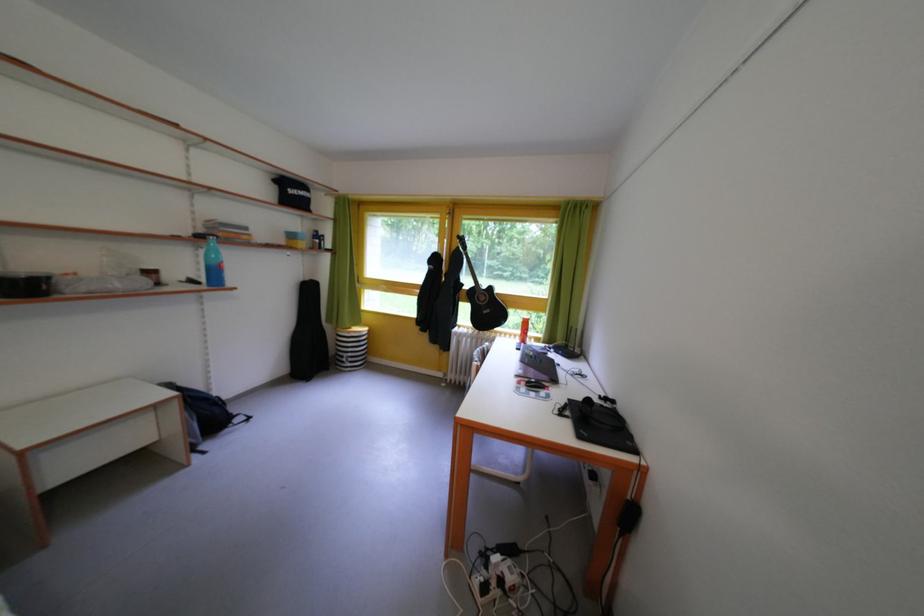
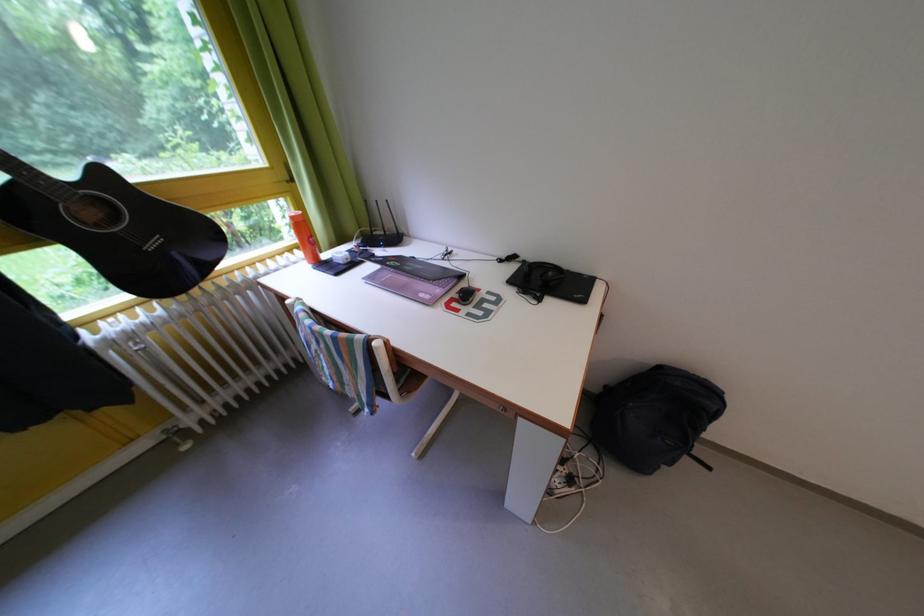
Find the pixel in the second image that matches point 500,294 in the first image.

(112, 179)